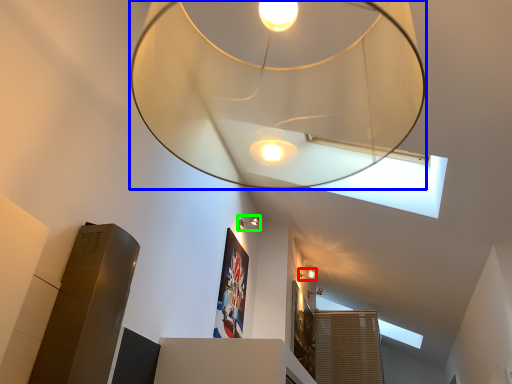
Question: Which object is positioned farthest from lamp (highlighted by a red box)? Select from lamp (highlighted by a blue box) and lamp (highlighted by a green box).

Choices:
 (A) lamp
 (B) lamp

Answer: (A)